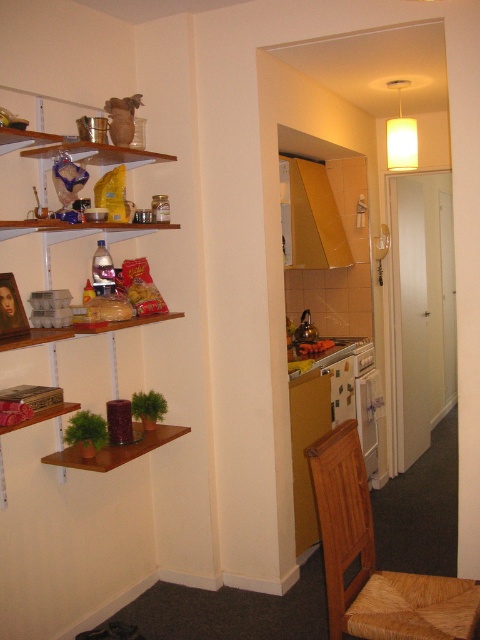
You are sitting in the woven straw chair at lower right and want to reach the smooth plastic container at center. Is it possible to do so without moving from your current position?

The woven straw chair at lower right is closer to the viewer than the smooth plastic container at center, so you can reach the smooth plastic container at center from your current position in the woven straw chair at lower right as it is further away but still within reach.

You are standing at the entrance of the kitchen and want to sit down. There is a woven straw chair at lower right. Can you reach it without moving any objects in the kitchen?

The position of the woven straw chair at lower right is at point (382, 554), so yes, you can reach it without moving any objects in the kitchen.